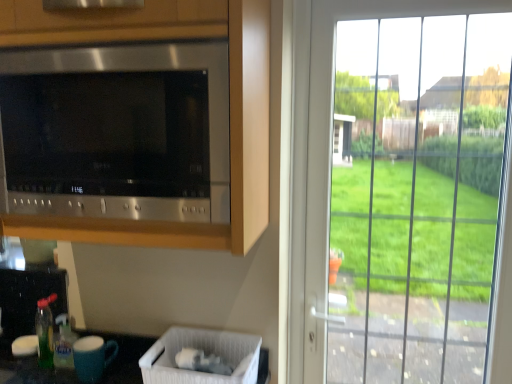
Locate an element on the screen. green translucent bottle at lower left is located at coordinates (64, 343).

Describe the element at coordinates (92, 357) in the screenshot. This screenshot has width=512, height=384. I see `blue matte mug at lower left` at that location.

At what (x,y) coordinates should I click in order to perform the action: click on stainless steel microwave at upper left. Please return your answer as a coordinate pair (x, y). The image size is (512, 384). Looking at the image, I should click on (230, 111).

In order to face white plastic laundry basket at lower center, should I rotate leftwards or rightwards?

Rotate your view left by about 6.641°.

Identify the location of green translucent bottle at lower left. (64, 343).

The image size is (512, 384). There is a white plastic laundry basket at lower center. Find the location of `bottle above it (from a real-world perspective)`. bottle above it (from a real-world perspective) is located at coordinates (64, 343).

Does green translucent bottle at lower left appear on the left side of white plastic laundry basket at lower center?

Yes, green translucent bottle at lower left is to the left of white plastic laundry basket at lower center.

From a real-world perspective, is green translucent bottle at lower left located higher than white plastic laundry basket at lower center?

Correct, in the physical world, green translucent bottle at lower left is higher than white plastic laundry basket at lower center.

Is green translucent bottle at lower left positioned before white plastic laundry basket at lower center?

No, green translucent bottle at lower left is further to the viewer.

From a real-world perspective, which is physically below, stainless steel microwave at upper left or clear glass door at right?

In real-world perspective, clear glass door at right is lower.

In the image, is stainless steel microwave at upper left on the left side or the right side of clear glass door at right?

stainless steel microwave at upper left is positioned on clear glass door at right's left side.

Between stainless steel microwave at upper left and clear glass door at right, which one has more height?

With more height is clear glass door at right.

Is stainless steel microwave at upper left wider than blue matte mug at lower left?

Yes, stainless steel microwave at upper left is wider than blue matte mug at lower left.

Which object is closer to the camera, stainless steel microwave at upper left or blue matte mug at lower left?

stainless steel microwave at upper left is in front.

Are stainless steel microwave at upper left and blue matte mug at lower left located far from each other?

No, there isn't a large distance between stainless steel microwave at upper left and blue matte mug at lower left.

Is stainless steel microwave at upper left not inside blue matte mug at lower left?

Yes, stainless steel microwave at upper left is not within blue matte mug at lower left.

Does green translucent bottle at lower left have a larger size compared to blue matte mug at lower left?

No.

Is green translucent bottle at lower left further to the viewer compared to blue matte mug at lower left?

Yes, green translucent bottle at lower left is further from the viewer.

Between point (57, 356) and point (75, 357), which one is positioned behind?

The point (57, 356) is behind.

Based on the photo, from the image's perspective, does clear glass door at right appear lower than blue matte mug at lower left?

No, from the image's perspective, clear glass door at right is not beneath blue matte mug at lower left.

Would you consider clear glass door at right to be distant from blue matte mug at lower left?

They are positioned close to each other.

Considering the sizes of objects clear glass door at right and blue matte mug at lower left in the image provided, who is thinner, clear glass door at right or blue matte mug at lower left?

Thinner between the two is clear glass door at right.

Does point (309, 162) lie in front of point (94, 371)?

No, (309, 162) is behind (94, 371).

What are the coordinates of `window located below the stainless steel microwave at upper left (from the image's perspective)` in the screenshot? It's located at (327, 157).

Which of these two, clear glass door at right or stainless steel microwave at upper left, is smaller?

Smaller between the two is clear glass door at right.

Considering the sizes of clear glass door at right and stainless steel microwave at upper left in the image, is clear glass door at right taller or shorter than stainless steel microwave at upper left?

Considering their sizes, clear glass door at right has more height than stainless steel microwave at upper left.

Which object is wider, clear glass door at right or stainless steel microwave at upper left?

stainless steel microwave at upper left.

Considering their positions, is blue matte mug at lower left located in front of or behind stainless steel microwave at upper left?

blue matte mug at lower left is behind stainless steel microwave at upper left.

Is blue matte mug at lower left not close to stainless steel microwave at upper left?

No.

From a real-world perspective, who is located lower, blue matte mug at lower left or stainless steel microwave at upper left?

blue matte mug at lower left is physically lower.

Considering the positions of point (102, 364) and point (39, 19), is point (102, 364) closer or farther from the camera than point (39, 19)?

Point (102, 364) is farther from the camera than point (39, 19).

Identify the location of laundry basket below the green translucent bottle at lower left (from a real-world perspective). (205, 351).

The height and width of the screenshot is (384, 512). In order to click on cabinetry above the clear glass door at right (from the image's perspective) in this screenshot , I will do click(x=230, y=111).

Considering their positions, is stainless steel microwave at upper left positioned closer to white plastic laundry basket at lower center than green translucent bottle at lower left?

green translucent bottle at lower left lies closer to white plastic laundry basket at lower center than the other object.

Which object lies nearer to the anchor point green translucent bottle at lower left, white plastic laundry basket at lower center or blue matte mug at lower left?

blue matte mug at lower left is closer to green translucent bottle at lower left.

When comparing their distances from stainless steel microwave at upper left, does green translucent bottle at lower left or white plastic laundry basket at lower center seem closer?

white plastic laundry basket at lower center.

Looking at the image, which one is located further to green translucent bottle at lower left, clear glass door at right or white plastic laundry basket at lower center?

Among the two, clear glass door at right is located further to green translucent bottle at lower left.

When comparing their distances from clear glass door at right, does blue matte mug at lower left or white plastic laundry basket at lower center seem closer?

white plastic laundry basket at lower center is positioned closer to the anchor clear glass door at right.

Estimate the real-world distances between objects in this image. Which object is further from stainless steel microwave at upper left, blue matte mug at lower left or white plastic laundry basket at lower center?

Among the two, blue matte mug at lower left is located further to stainless steel microwave at upper left.

Considering their positions, is blue matte mug at lower left positioned closer to green translucent bottle at lower left than white plastic laundry basket at lower center?

blue matte mug at lower left.

Which object lies nearer to the anchor point green translucent bottle at lower left, stainless steel microwave at upper left or clear glass door at right?

The object closer to green translucent bottle at lower left is stainless steel microwave at upper left.

Identify the location of cabinetry between green translucent bottle at lower left and clear glass door at right from left to right. Image resolution: width=512 pixels, height=384 pixels. (230, 111).

At what (x,y) coordinates should I click in order to perform the action: click on bottle between stainless steel microwave at upper left and blue matte mug at lower left vertically. Please return your answer as a coordinate pair (x, y). Looking at the image, I should click on (64, 343).

At what (x,y) coordinates should I click in order to perform the action: click on laundry basket situated between green translucent bottle at lower left and clear glass door at right from left to right. Please return your answer as a coordinate pair (x, y). The image size is (512, 384). Looking at the image, I should click on (205, 351).

This screenshot has width=512, height=384. In order to click on cabinetry between blue matte mug at lower left and clear glass door at right in the horizontal direction in this screenshot , I will do `click(230, 111)`.